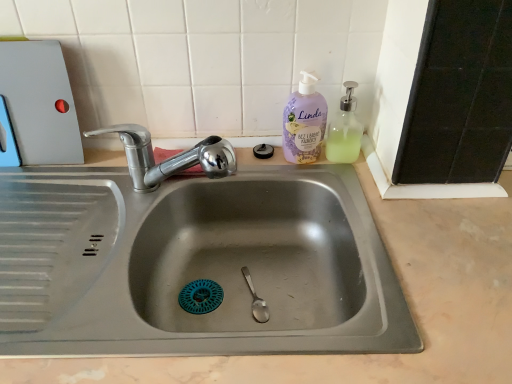
Question: Is lavender-colored pump bottle at upper right bigger or smaller than matte plastic cutting board at upper left?

Choices:
 (A) small
 (B) big

Answer: (A)

Question: In the image, is lavender-colored pump bottle at upper right positioned in front of or behind matte plastic cutting board at upper left?

Choices:
 (A) behind
 (B) front

Answer: (A)

Question: Which is farther from the lavender-colored pump bottle at upper right?

Choices:
 (A) matte plastic cutting board at upper left
 (B) clear plastic soap dispenser at upper right
 (C) chrome metallic faucet at upper left

Answer: (A)

Question: Considering the real-world distances, which object is closest to the chrome metallic faucet at upper left?

Choices:
 (A) matte plastic cutting board at upper left
 (B) clear plastic soap dispenser at upper right
 (C) lavender-colored pump bottle at upper right

Answer: (A)